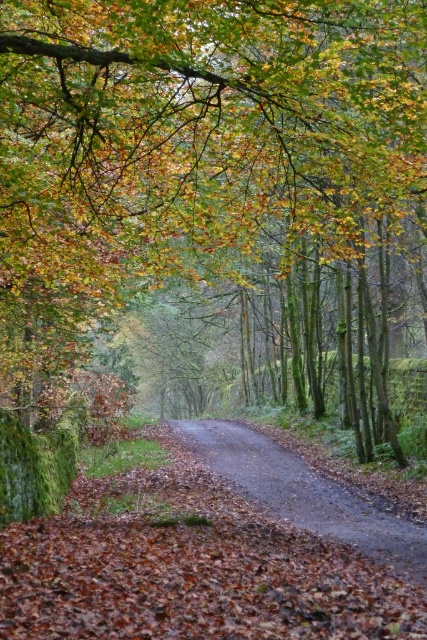
You are a hiker standing on the damp asphalt road at center and want to take a photo of the green leafy tree at center. Since the tree is in your way, can you still capture the entire tree in your photo?

The green leafy tree at center is above damp asphalt road at center, so you can still capture the entire tree in your photo because it is positioned above the road and not blocking your view.

You are a hiker trying to navigate through the forest. You see the green leafy tree at center and the damp asphalt road at center. Which object is taller?

The green leafy tree at center is much taller than the damp asphalt road at center.

In the scene shown: You are a hiker walking along the winding dirt path in the autumn forest. You notice two points marked on the path. One is at coordinate point (295, 90) and the other is at point (368, 513). If you are facing the direction of the path, which point would you encounter first?

Point (295, 90) is in front of point (368, 513), so you would encounter point (295, 90) first as you walk along the path.